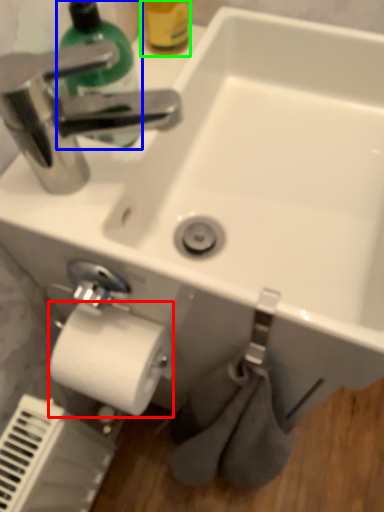
Question: Considering the real-world distances, which object is farthest from toilet paper (highlighted by a red box)? cleaning product (highlighted by a blue box) or bottle (highlighted by a green box)?

Choices:
 (A) cleaning product
 (B) bottle

Answer: (B)